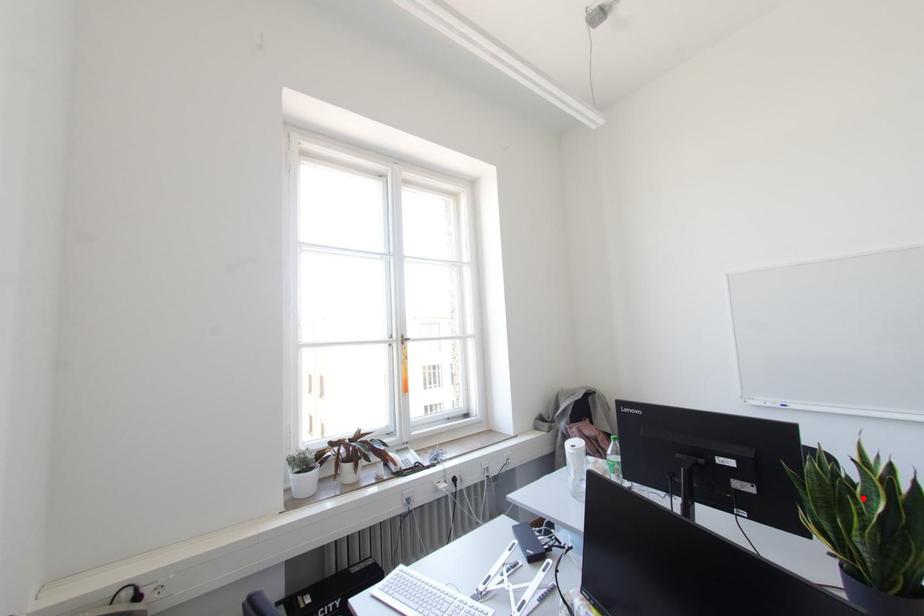
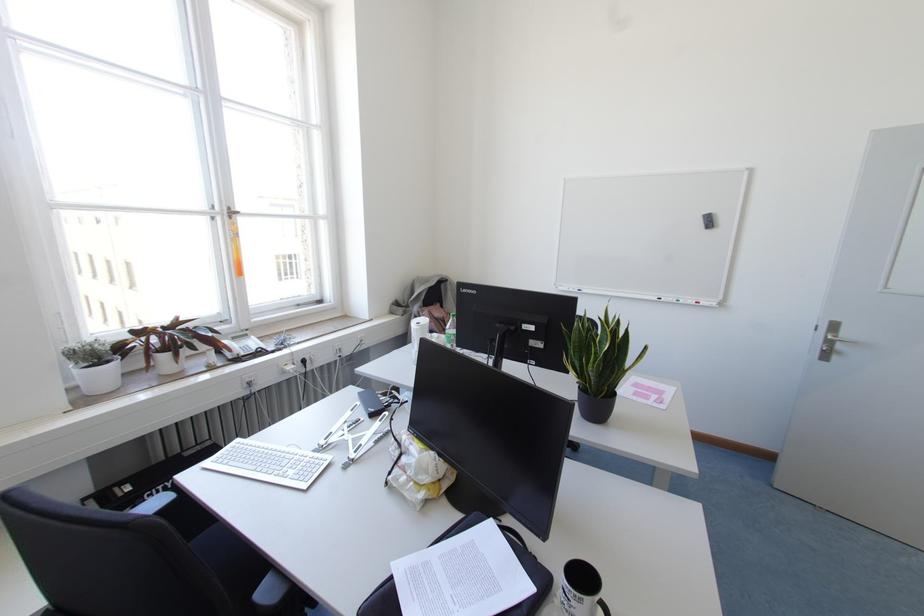
Locate, in the second image, the point that corresponds to the highlighted location in the first image.

(599, 342)